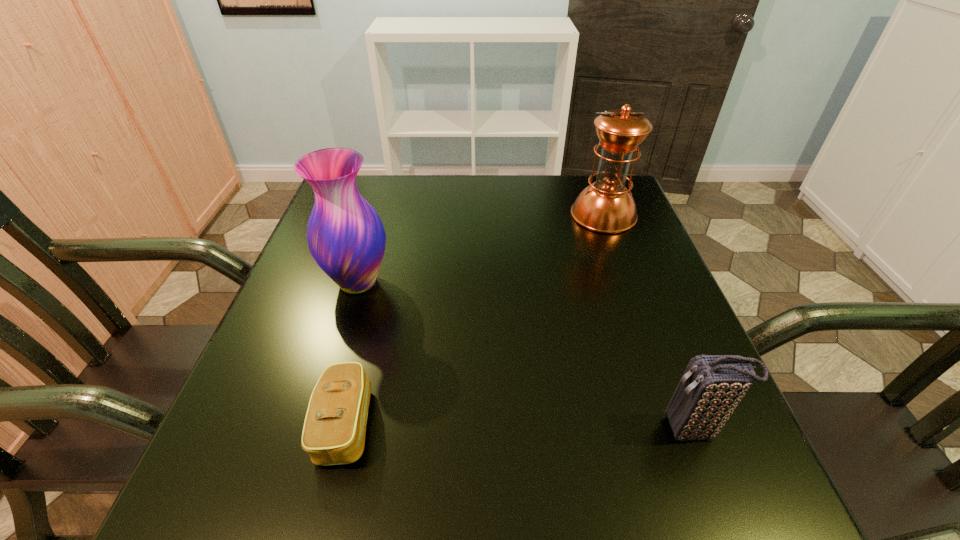
Image resolution: width=960 pixels, height=540 pixels. I want to click on oil lamp, so click(x=606, y=206).

Locate an element on the screen. The height and width of the screenshot is (540, 960). vase is located at coordinates (346, 237).

Where is `the right clutch bag`? the right clutch bag is located at coordinates (711, 387).

Where is `the third tallest object`? the third tallest object is located at coordinates tap(711, 387).

Identify the location of the left clutch bag. The width and height of the screenshot is (960, 540). pos(334,430).

Where is `the shortest object`? The height and width of the screenshot is (540, 960). the shortest object is located at coordinates (334, 430).

I want to click on free point located on the left of the farthest object, so click(x=447, y=214).

Locate an element on the screen. blank space located 0.190m on the right of the vase is located at coordinates (481, 282).

I want to click on vacant space situated with the zip open on the taller clutch bag, so click(610, 429).

Locate an element on the screen. vacant space located with the zip open on the taller clutch bag is located at coordinates (502, 429).